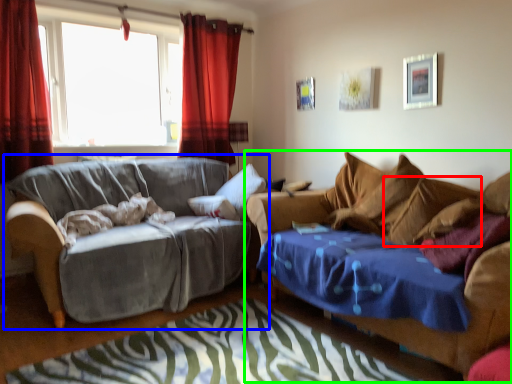
Question: Which is nearer to the pillow (highlighted by a red box)? studio couch (highlighted by a blue box) or studio couch (highlighted by a green box).

Choices:
 (A) studio couch
 (B) studio couch

Answer: (B)